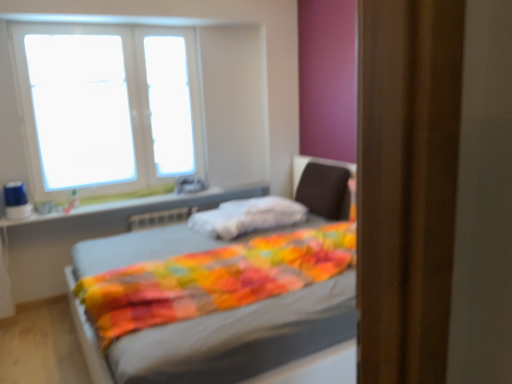
Where is `empty space that is ontop of transparent glass window at upper left, the 1th window screen viewed from the left (from a real-world perspective)`? empty space that is ontop of transparent glass window at upper left, the 1th window screen viewed from the left (from a real-world perspective) is located at coordinates (82, 83).